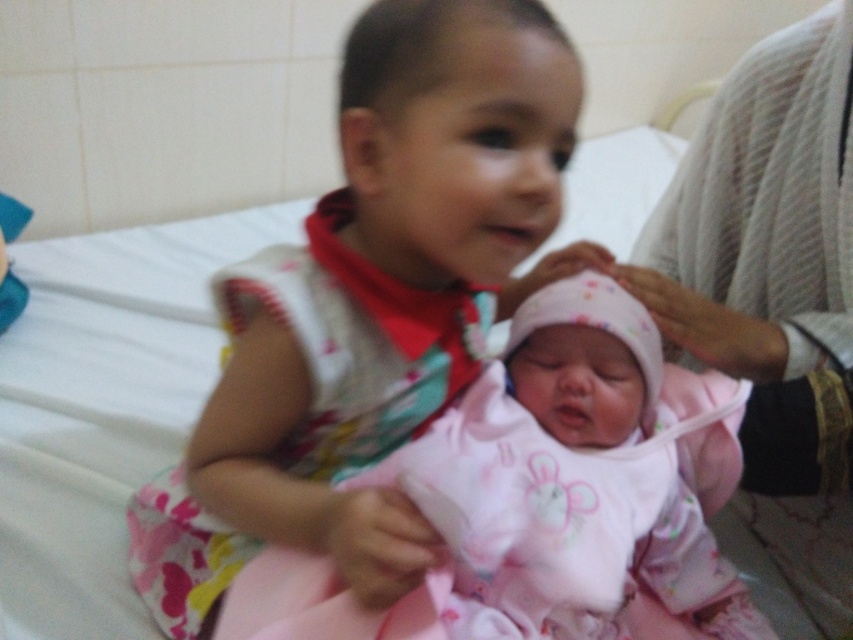
Question: Observing the image, what is the correct spatial positioning of matte pink dress at center in reference to pink fabric baby at center?

Choices:
 (A) left
 (B) right

Answer: (A)

Question: Among these points, which one is nearest to the camera?

Choices:
 (A) (590, 428)
 (B) (363, 212)

Answer: (B)

Question: Can you confirm if matte pink dress at center is wider than pink fabric baby at center?

Choices:
 (A) no
 (B) yes

Answer: (B)

Question: Is matte pink dress at center thinner than pink fabric baby at center?

Choices:
 (A) yes
 (B) no

Answer: (B)